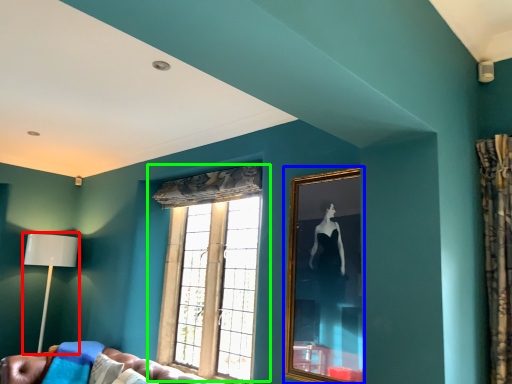
Question: Which object is positioned closest to table lamp (highlighted by a red box)? Select from picture frame (highlighted by a blue box) and window (highlighted by a green box).

Choices:
 (A) picture frame
 (B) window

Answer: (B)